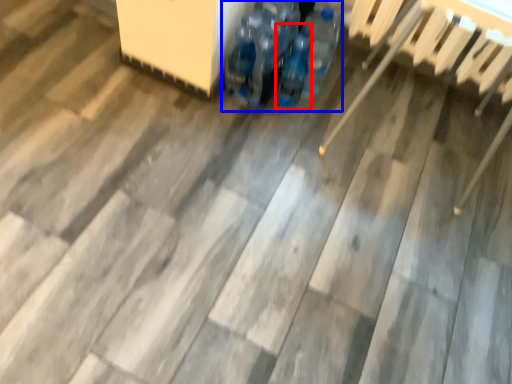
Question: Which object is closer to the camera taking this photo, bottle (highlighted by a red box) or footwear (highlighted by a blue box)?

Choices:
 (A) bottle
 (B) footwear

Answer: (B)